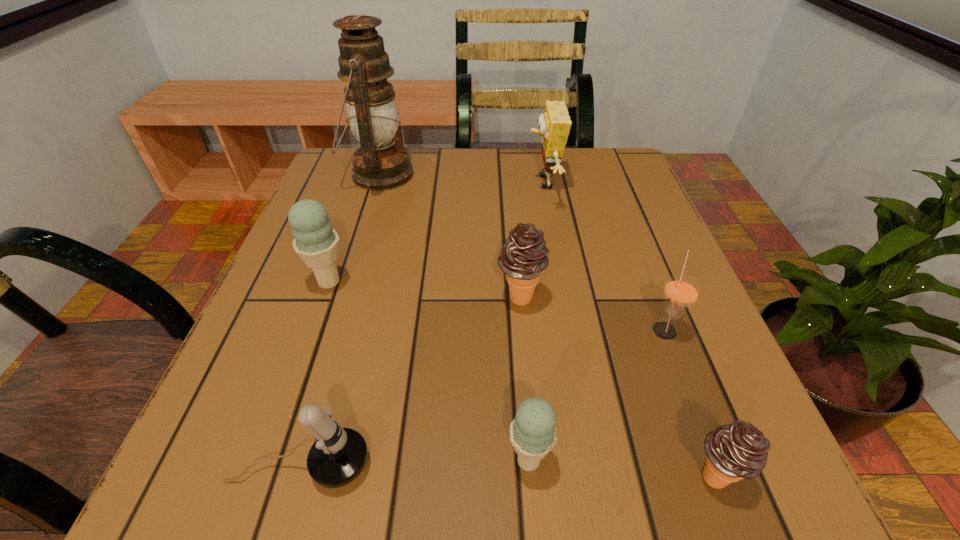
Identify the location of the second closest icecream to the right blue ice cream. Image resolution: width=960 pixels, height=540 pixels. (523, 258).

You are a GUI agent. You are given a task and a screenshot of the screen. Output one action in this format:
    pyautogui.click(x=<x>, y=<y>)
    Task: Click on the free location that satisfies the following two spatial constraints: 1. on the face of the yellow sponge; 2. on the front side of the bigger blue ice cream
    
    Given the screenshot: What is the action you would take?
    pyautogui.click(x=561, y=281)